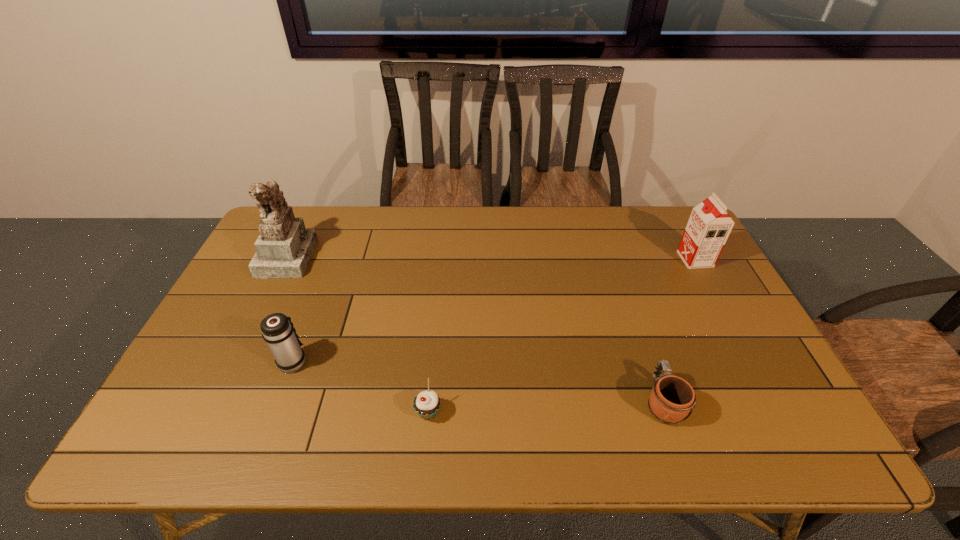
The width and height of the screenshot is (960, 540). In order to click on free spot located on the side with the handle of the third farthest object in this screenshot , I will do `click(330, 263)`.

Locate an element on the screen. The image size is (960, 540). free region located on the side with the handle of the third farthest object is located at coordinates (334, 253).

Image resolution: width=960 pixels, height=540 pixels. In order to click on free region located on the side with the handle of the third farthest object in this screenshot , I will do `click(316, 301)`.

Image resolution: width=960 pixels, height=540 pixels. Find the location of `free point located on the back of the third object from left to right`. free point located on the back of the third object from left to right is located at coordinates (439, 300).

This screenshot has width=960, height=540. What are the coordinates of `vacant space located on the side of the second object from right to left with the handle` in the screenshot? It's located at (636, 324).

I want to click on free space located 0.380m on the side of the second object from right to left with the handle, so click(618, 272).

Find the location of a particular element. free space located 0.340m on the side of the second object from right to left with the handle is located at coordinates (622, 281).

Where is `object positioned at the far edge`? Image resolution: width=960 pixels, height=540 pixels. object positioned at the far edge is located at coordinates (284, 247).

Locate an element on the screen. The image size is (960, 540). cupcake that is at the near edge is located at coordinates (426, 404).

The height and width of the screenshot is (540, 960). Identify the location of mug present at the near edge. (671, 401).